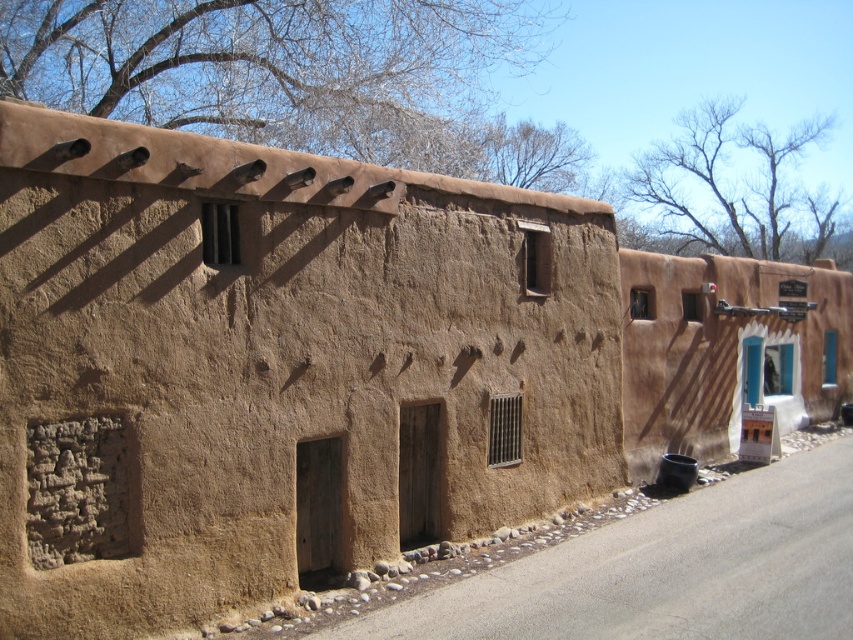
Who is higher up, brown mudbrick wall at center or brown adobe wall at right?

Positioned higher is brown adobe wall at right.

Which is in front, point (299, 429) or point (637, 332)?

Point (299, 429)

What are the coordinates of `brown mudbrick wall at center` in the screenshot? It's located at (276, 369).